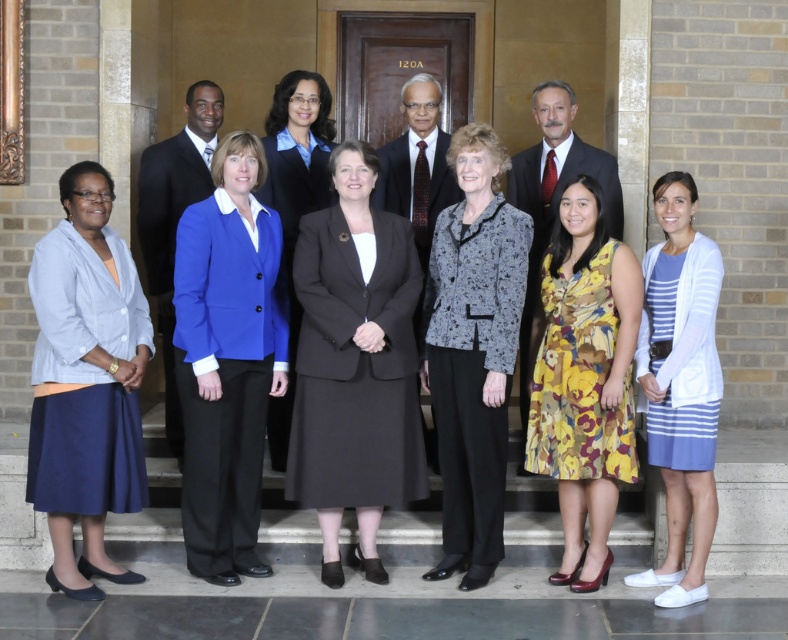
Question: Which point is farther to the camera?

Choices:
 (A) (534, 113)
 (B) (281, 150)
 (C) (235, 157)

Answer: (A)

Question: Can you confirm if black matte suit at center is positioned above blue fabric blazer at center?

Choices:
 (A) yes
 (B) no

Answer: (B)

Question: Can you confirm if black matte suit at center is positioned to the right of dark gray suit at center?

Choices:
 (A) no
 (B) yes

Answer: (A)

Question: Based on their relative distances, which object is nearer to the light blue fabric skirt at lower left?

Choices:
 (A) white striped dress at lower right
 (B) matte black suit at center
 (C) dark gray suit at center

Answer: (C)

Question: Is black matte suit at center smaller than dark gray suit at center?

Choices:
 (A) no
 (B) yes

Answer: (A)

Question: Which of the following is the farthest from the observer?

Choices:
 (A) shiny black suit at center
 (B) matte blue blazer at center
 (C) printed fabric blazer at center
 (D) floral print dress at center

Answer: (A)